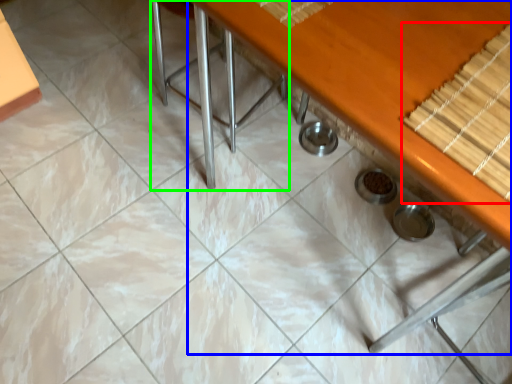
Question: Estimate the real-world distances between objects in this image. Which object is closer to wood (highlighted by a red box), table (highlighted by a blue box) or chair (highlighted by a green box)?

Choices:
 (A) table
 (B) chair

Answer: (A)